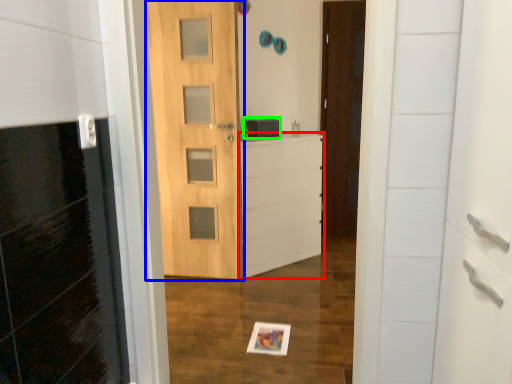
Question: Which is farther away from file cabinet (highlighted by a red box)? door (highlighted by a blue box) or medicine cabinet (highlighted by a green box)?

Choices:
 (A) door
 (B) medicine cabinet

Answer: (B)